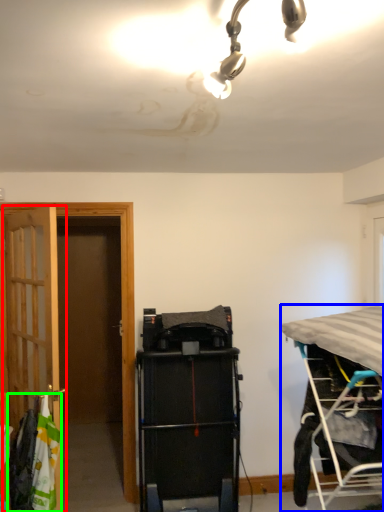
Question: Based on their relative distances, which object is nearer to door (highlighted by a red box)? Choose from bed (highlighted by a blue box) and laundry (highlighted by a green box).

Choices:
 (A) bed
 (B) laundry

Answer: (B)